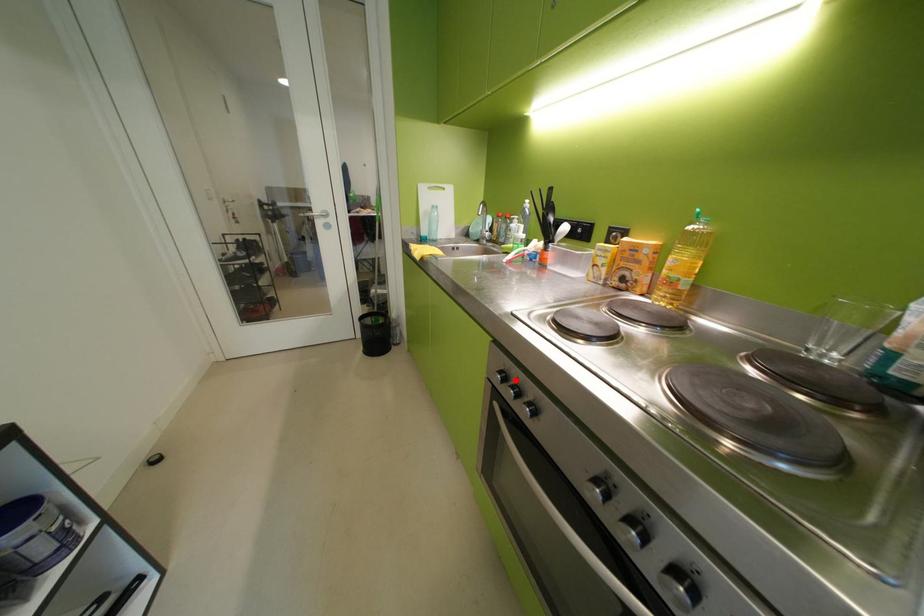
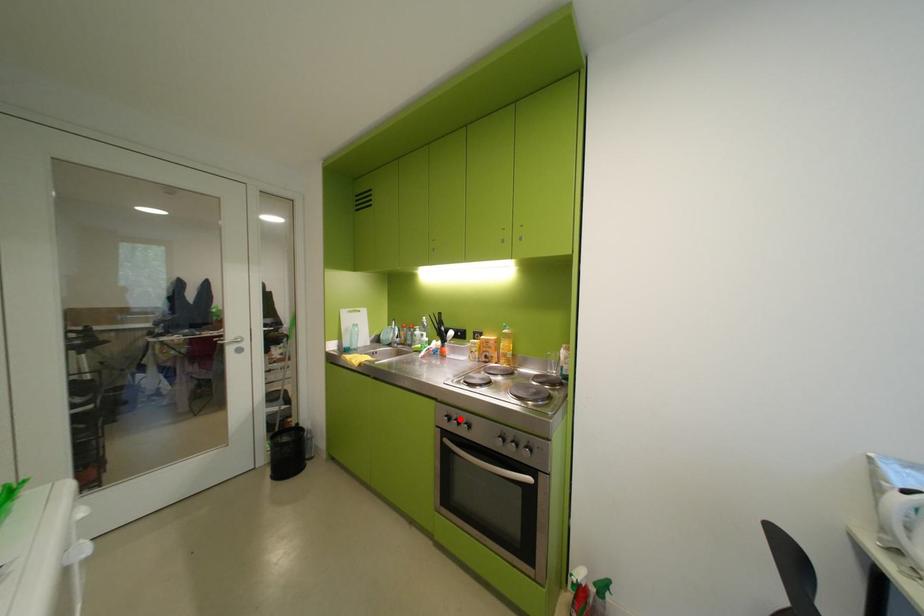
I am providing you with two images of the same scene from different viewpoints. A red point is marked on the first image and another point is marked on the second image. Do the highlighted points in image1 and image2 indicate the same real-world spot?

Yes